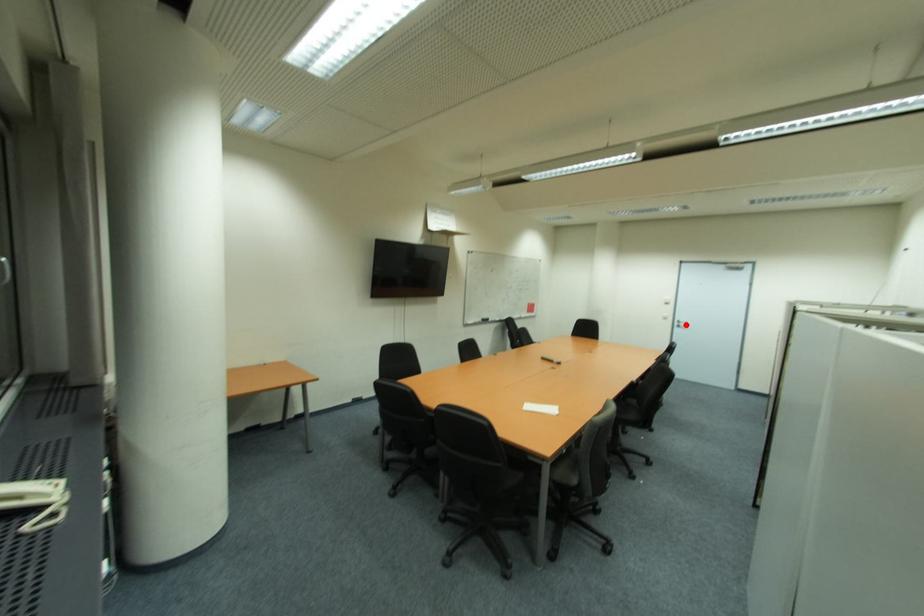
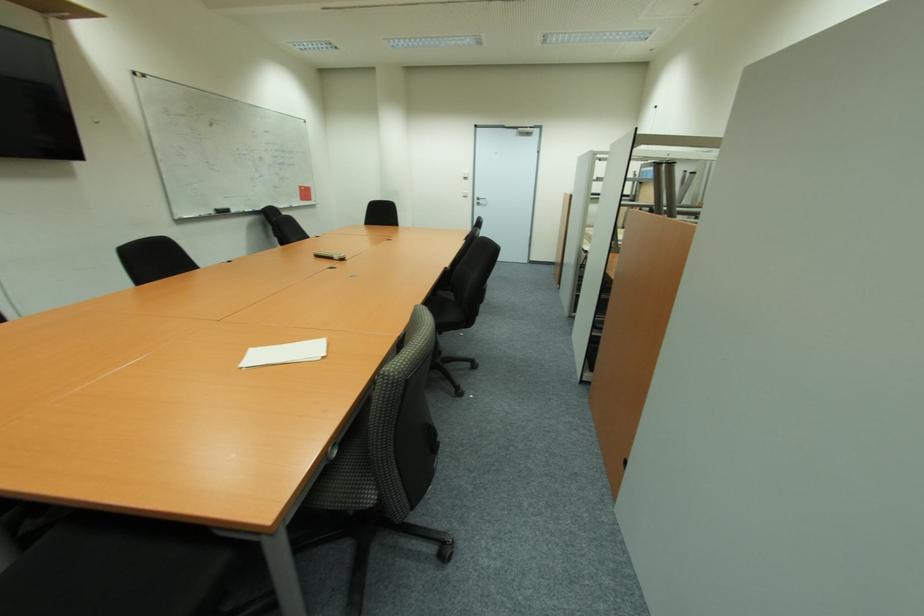
Question: I am providing you with two images of the same scene from different viewpoints. A red point is shown in image1. For the corresponding object point in image2, is it positioned nearer or farther from the camera?

Choices:
 (A) Nearer
 (B) Farther

Answer: (A)